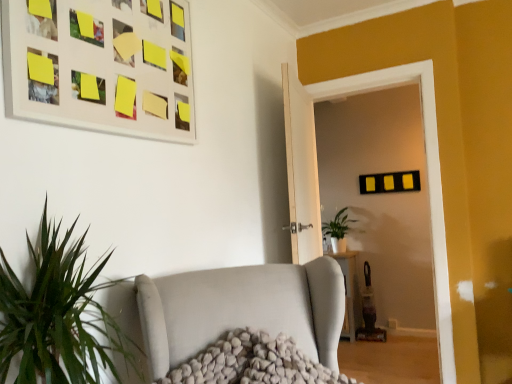
Measure the distance between point [68,33] and camera.

The depth of point [68,33] is 4.17 feet.

You are a GUI agent. You are given a task and a screenshot of the screen. Output one action in this format:
    pyautogui.click(x=<x>, y=<y>)
    Task: Click on the green matte plant at center
    This screenshot has height=384, width=512.
    Given the screenshot: What is the action you would take?
    pyautogui.click(x=338, y=230)

Is green matte plant at center a part of matte white picture frame at upper left?

No, green matte plant at center is not surrounded by matte white picture frame at upper left.

Considering the points (20, 47) and (327, 222), which point is behind, point (20, 47) or point (327, 222)?

The point (327, 222) is behind.

Which object is wider, matte white picture frame at upper left or green matte plant at center?

Wider between the two is green matte plant at center.

Is matte white picture frame at upper left far from green matte plant at center?

Yes, matte white picture frame at upper left and green matte plant at center are located far from each other.

Is white textured studio couch at center positioned with its back to matte black glass door at center?

white textured studio couch at center does not have its back to matte black glass door at center.

Looking at this image, can you tell me how much white textured studio couch at center and matte black glass door at center differ in facing direction?

67.9 degrees.

From the image's perspective, which one is positioned lower, white textured studio couch at center or matte black glass door at center?

white textured studio couch at center.

Based on the photo, can you tell me how much green matte plant at center and matte white picture frame at upper left differ in facing direction?

The angular difference between green matte plant at center and matte white picture frame at upper left is 90.6 degrees.

Is green matte plant at center taller than matte white picture frame at upper left?

Incorrect, the height of green matte plant at center is not larger of that of matte white picture frame at upper left.

Looking at this image, from the image's perspective, does green matte plant at center appear lower than matte white picture frame at upper left?

Correct, green matte plant at center appears lower than matte white picture frame at upper left in the image.

Consider the image. Is green matte plant at center inside or outside of matte white picture frame at upper left?

green matte plant at center is spatially situated outside matte white picture frame at upper left.

Is matte white picture frame at upper left surrounding matte black glass door at center?

No, matte black glass door at center is not surrounded by matte white picture frame at upper left.

Is matte white picture frame at upper left far from matte black glass door at center?

Absolutely, matte white picture frame at upper left is distant from matte black glass door at center.

The width and height of the screenshot is (512, 384). There is a matte black glass door at center. In order to click on picture frame above it (from a real-world perspective) in this screenshot , I will do `click(101, 65)`.

Measure the distance from matte white picture frame at upper left to matte black glass door at center.

1.17 meters.

Which of these two, green matte plant at center or matte black glass door at center, stands shorter?

With less height is green matte plant at center.

Measure the distance from green matte plant at center to matte black glass door at center.

green matte plant at center and matte black glass door at center are 4.12 feet apart from each other.

From the image's perspective, is green matte plant at center on matte black glass door at center?

Incorrect, from the image's perspective, green matte plant at center is lower than matte black glass door at center.

From a real-world perspective, is green matte plant at center above or below matte black glass door at center?

Clearly, from a real-world perspective, green matte plant at center is below matte black glass door at center.

Is green matte plant at center taller or shorter than white textured studio couch at center?

In the image, green matte plant at center appears to be taller than white textured studio couch at center.

Is green matte plant at center spatially inside white textured studio couch at center, or outside of it?

green matte plant at center is spatially situated outside white textured studio couch at center.

Looking at this image, which object is positioned more to the left, green matte plant at center or white textured studio couch at center?

From the viewer's perspective, white textured studio couch at center appears more on the left side.

Is green matte plant at center placed right next to white textured studio couch at center?

No, green matte plant at center is not beside white textured studio couch at center.

Who is smaller, white textured studio couch at center or green matte plant at center?

Smaller between the two is white textured studio couch at center.

Would you say white textured studio couch at center contains green matte plant at center?

No, green matte plant at center is not inside white textured studio couch at center.

Could you tell me if white textured studio couch at center is turned towards green matte plant at center?

No.

The height and width of the screenshot is (384, 512). What are the coordinates of `picture frame on the left of green matte plant at center` in the screenshot? It's located at (101, 65).

Image resolution: width=512 pixels, height=384 pixels. In order to click on glass door above the white textured studio couch at center (from the image's perspective) in this screenshot , I will do `click(318, 177)`.

Which object lies nearer to the anchor point matte black glass door at center, green matte plant at center or matte white picture frame at upper left?

matte white picture frame at upper left is positioned closer to the anchor matte black glass door at center.

When comparing their distances from white textured studio couch at center, does matte black glass door at center or matte white picture frame at upper left seem closer?

matte white picture frame at upper left is positioned closer to the anchor white textured studio couch at center.

Estimate the real-world distances between objects in this image. Which object is closer to green matte plant at center, matte white picture frame at upper left or matte black glass door at center?

matte black glass door at center is positioned closer to the anchor green matte plant at center.

From the image, which object appears to be nearer to white textured studio couch at center, green matte plant at center or matte white picture frame at upper left?

matte white picture frame at upper left.

From the image, which object appears to be nearer to white textured studio couch at center, matte white picture frame at upper left or matte black glass door at center?

Based on the image, matte white picture frame at upper left appears to be nearer to white textured studio couch at center.

Based on their spatial positions, is matte black glass door at center or green matte plant at center further from white textured studio couch at center?

The object further to white textured studio couch at center is green matte plant at center.

Estimate the real-world distances between objects in this image. Which object is closer to white textured studio couch at center, matte white picture frame at upper left or green matte plant at center?

matte white picture frame at upper left is closer to white textured studio couch at center.

Which object lies nearer to the anchor point green matte plant at center, matte black glass door at center or matte white picture frame at upper left?

Among the two, matte black glass door at center is located nearer to green matte plant at center.

This screenshot has height=384, width=512. I want to click on glass door located between matte white picture frame at upper left and green matte plant at center in the depth direction, so click(x=318, y=177).

You are a GUI agent. You are given a task and a screenshot of the screen. Output one action in this format:
    pyautogui.click(x=<x>, y=<y>)
    Task: Click on the picture frame between white textured studio couch at center and green matte plant at center in the front-back direction
    
    Given the screenshot: What is the action you would take?
    pyautogui.click(x=101, y=65)

The image size is (512, 384). I want to click on glass door positioned between white textured studio couch at center and green matte plant at center from near to far, so click(x=318, y=177).

You are a GUI agent. You are given a task and a screenshot of the screen. Output one action in this format:
    pyautogui.click(x=<x>, y=<y>)
    Task: Click on the picture frame between white textured studio couch at center and matte black glass door at center along the z-axis
    
    Given the screenshot: What is the action you would take?
    pyautogui.click(x=101, y=65)